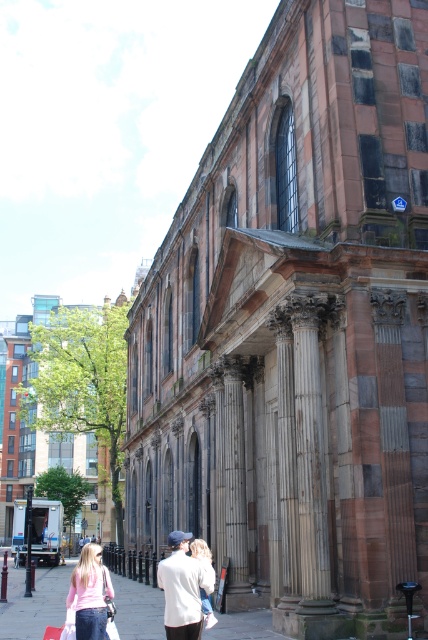
You are standing in front of the historic building and notice two points marked on the sidewalk. The first point is at coordinates point [68,586] and the second point is at point [59,545]. Which point is closer to you?

Point [68,586] is closer to the viewer than point [59,545].

You are standing in front of the grand historic building and notice the smooth concrete pavement at lower center and the pink matte shirt at lower left. Which object is positioned higher from the ground?

The smooth concrete pavement at lower center is much taller than the pink matte shirt at lower left, so it is positioned higher from the ground.